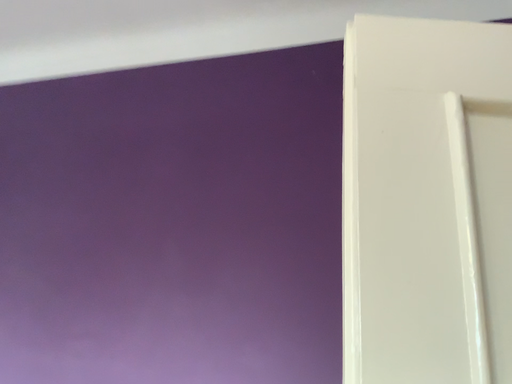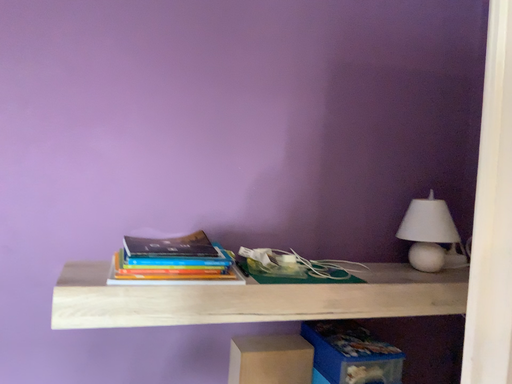
Question: Which way did the camera rotate in the video?

Choices:
 (A) rotated left
 (B) rotated right

Answer: (B)